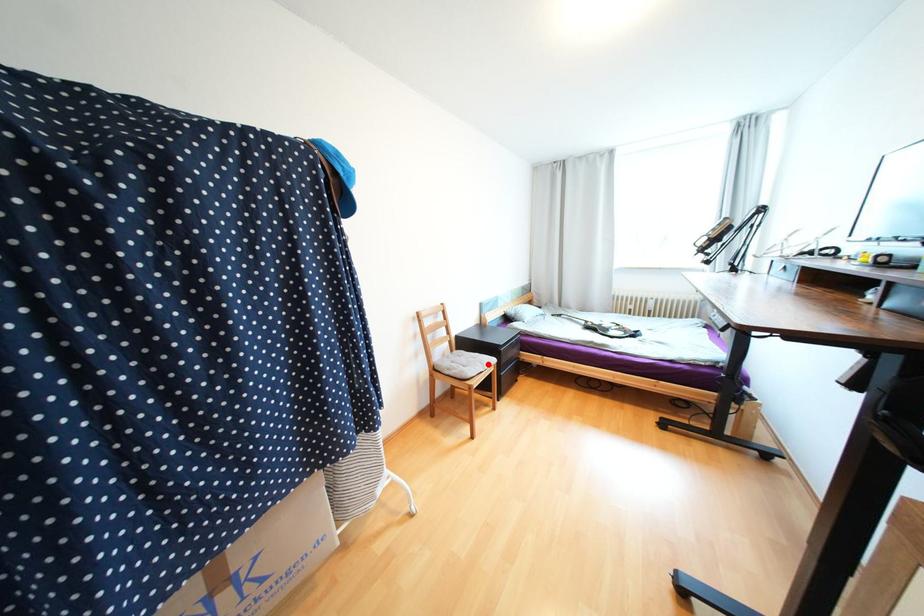
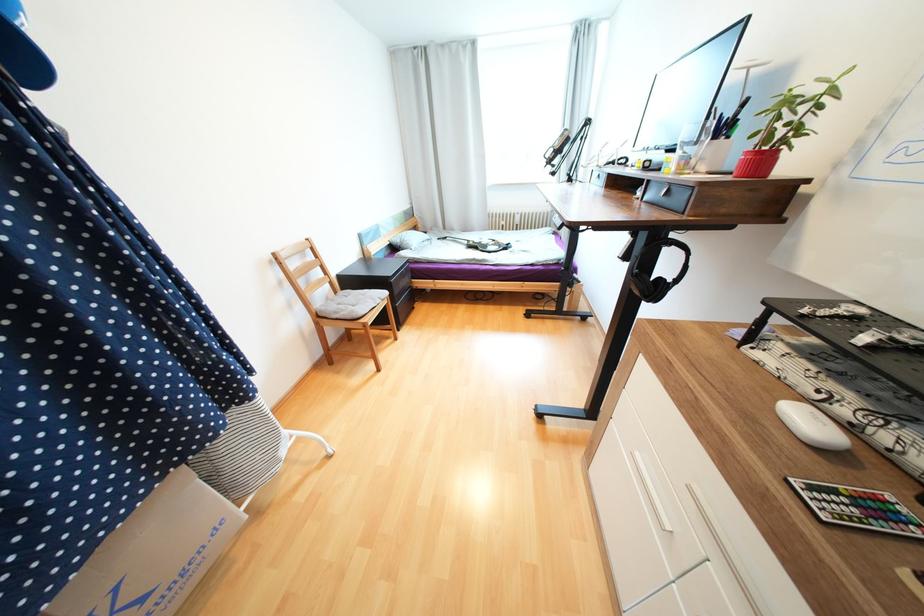
Question: I am providing you with two images of the same scene from different viewpoints. Given a red point in image1, look at the same physical point in image2. Is it:

Choices:
 (A) Closer to the viewpoint
 (B) Farther from the viewpoint

Answer: (A)